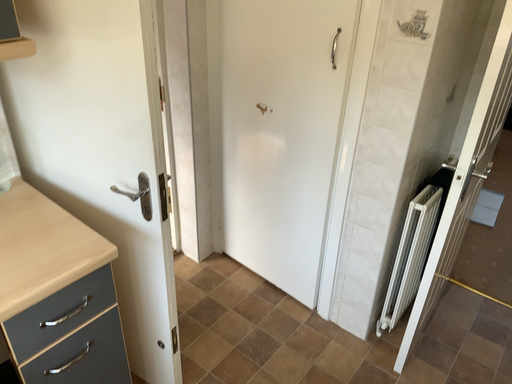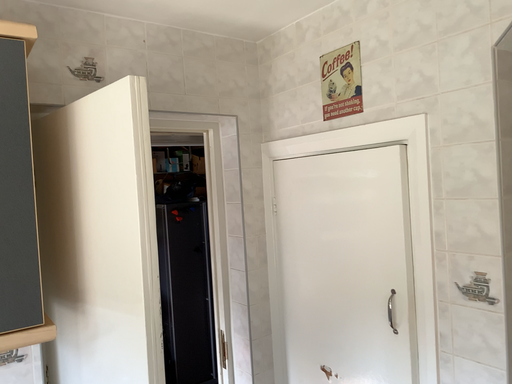
Question: How did the camera likely rotate when shooting the video?

Choices:
 (A) rotated upward
 (B) rotated downward

Answer: (A)